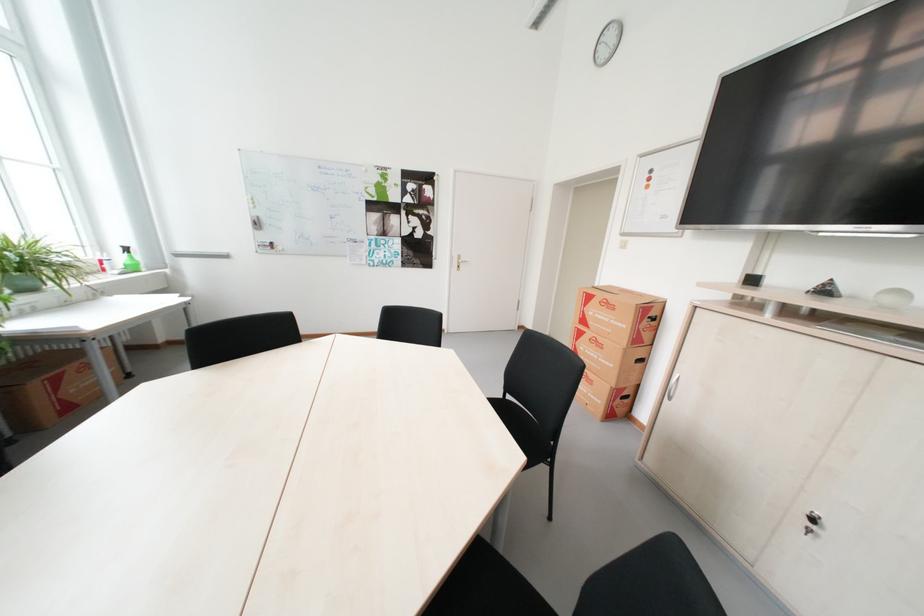
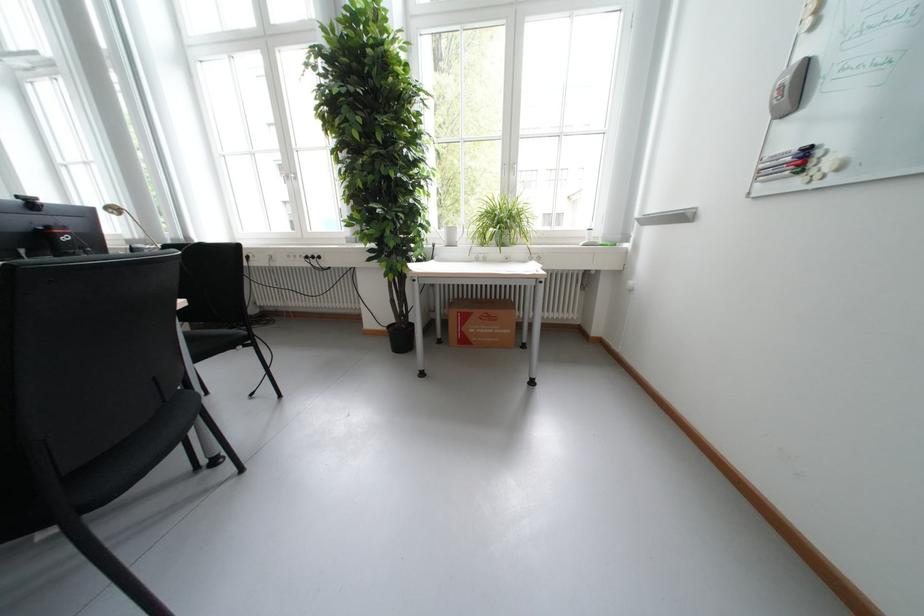
Where in the second image is the point corresponding to the point at 283,253 from the first image?

(806, 184)